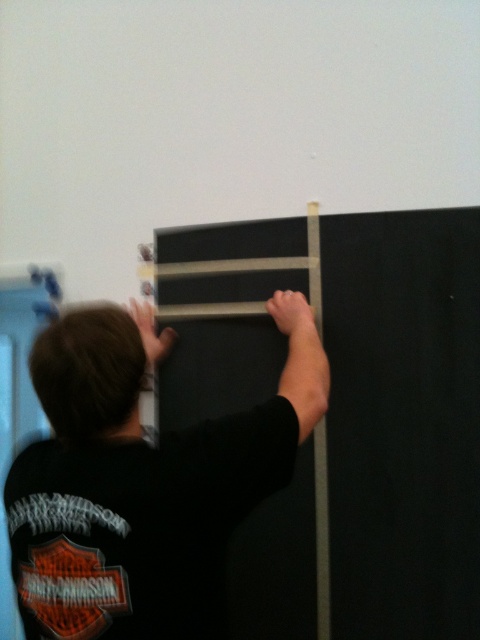
Question: Does black matte shirt at center appear on the right side of black matte ladder at center?

Choices:
 (A) yes
 (B) no

Answer: (B)

Question: Is black matte shirt at center to the left of black matte ladder at center from the viewer's perspective?

Choices:
 (A) no
 (B) yes

Answer: (B)

Question: Among these points, which one is nearest to the camera?

Choices:
 (A) (208, 248)
 (B) (48, 340)

Answer: (B)

Question: Which of the following is the farthest from the observer?

Choices:
 (A) (120, 467)
 (B) (235, 385)

Answer: (B)

Question: Which object is closer to the camera taking this photo?

Choices:
 (A) black matte ladder at center
 (B) black matte shirt at center

Answer: (B)

Question: Is black matte shirt at center thinner than black matte ladder at center?

Choices:
 (A) no
 (B) yes

Answer: (A)